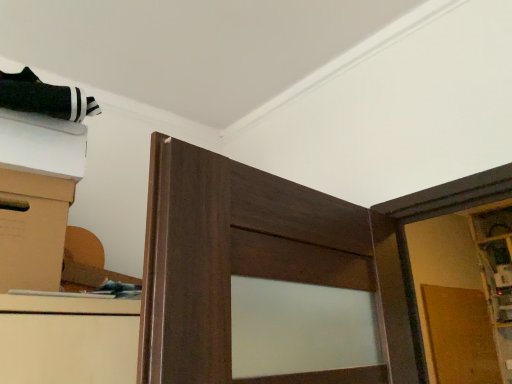
Question: Is brown cardboard box at left turned away from matte brown cabinet at right?

Choices:
 (A) no
 (B) yes

Answer: (A)

Question: Can you confirm if brown cardboard box at left is wider than matte brown cabinet at right?

Choices:
 (A) yes
 (B) no

Answer: (A)

Question: Considering the relative positions of brown cardboard box at left and matte brown cabinet at right in the image provided, is brown cardboard box at left to the left of matte brown cabinet at right from the viewer's perspective?

Choices:
 (A) yes
 (B) no

Answer: (A)

Question: Considering the relative positions of brown cardboard box at left and matte brown cabinet at right in the image provided, is brown cardboard box at left to the right of matte brown cabinet at right from the viewer's perspective?

Choices:
 (A) no
 (B) yes

Answer: (A)

Question: Is brown cardboard box at left far away from matte brown cabinet at right?

Choices:
 (A) no
 (B) yes

Answer: (B)

Question: Is matte brown cabinet at right a part of brown cardboard box at left?

Choices:
 (A) yes
 (B) no

Answer: (B)

Question: Is matte brown cabinet at right beside brown cardboard box at left?

Choices:
 (A) no
 (B) yes

Answer: (A)

Question: Is matte brown cabinet at right oriented towards brown cardboard box at left?

Choices:
 (A) no
 (B) yes

Answer: (B)

Question: Can we say matte brown cabinet at right lies outside brown cardboard box at left?

Choices:
 (A) no
 (B) yes

Answer: (B)

Question: Does matte brown cabinet at right have a lesser width compared to brown cardboard box at left?

Choices:
 (A) no
 (B) yes

Answer: (B)

Question: Does matte brown cabinet at right lie behind brown cardboard box at left?

Choices:
 (A) no
 (B) yes

Answer: (B)

Question: Can you confirm if matte brown cabinet at right is positioned to the left of brown cardboard box at left?

Choices:
 (A) no
 (B) yes

Answer: (A)

Question: From the image's perspective, is brown cardboard box at left positioned above or below matte brown cabinet at right?

Choices:
 (A) below
 (B) above

Answer: (B)